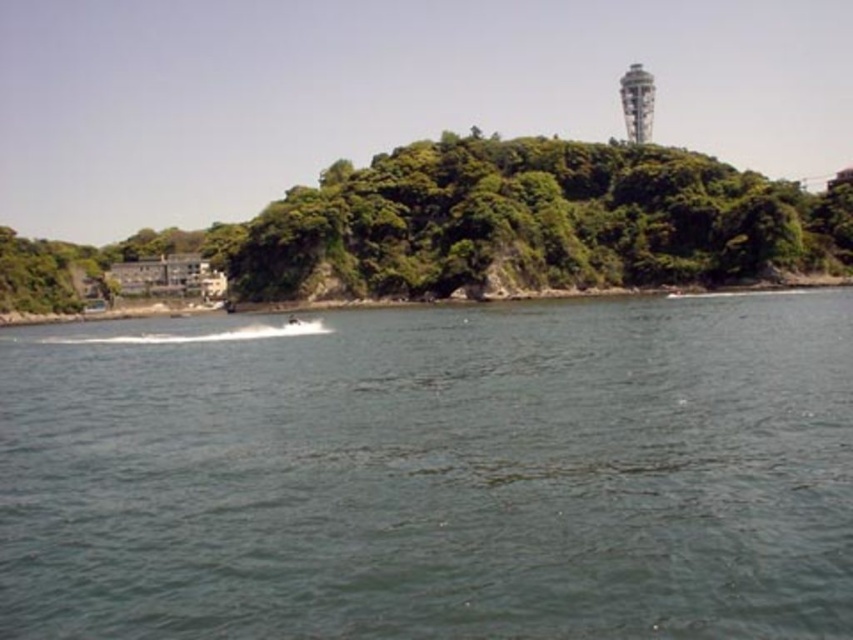
You are a drone operator trying to capture a photo of the coastal scene. You need to ensure that both points, point (782, 492) and point (637, 81), are visible in the frame. Based on their positions, which point should be closer to the front of the image?

Point (782, 492) is in front of point (637, 81), so it will be closer to the front of the image.

You are a photographer planning to capture the dark blue water at center and the white concrete tower at upper center in a single frame. Based on their sizes in the image, which object would you focus on first to ensure both are clearly visible?

The white concrete tower at upper center occupies more space in the image than the dark blue water at center, so focusing on the larger object first would help ensure both are visible.

You are a photographer trying to capture the dark blue water at center and the white concrete tower at upper center in a single shot. Based on their positions, which object will appear larger in the photo?

The dark blue water at center will appear larger in the photo because it is closer to the viewer than the white concrete tower at upper center.